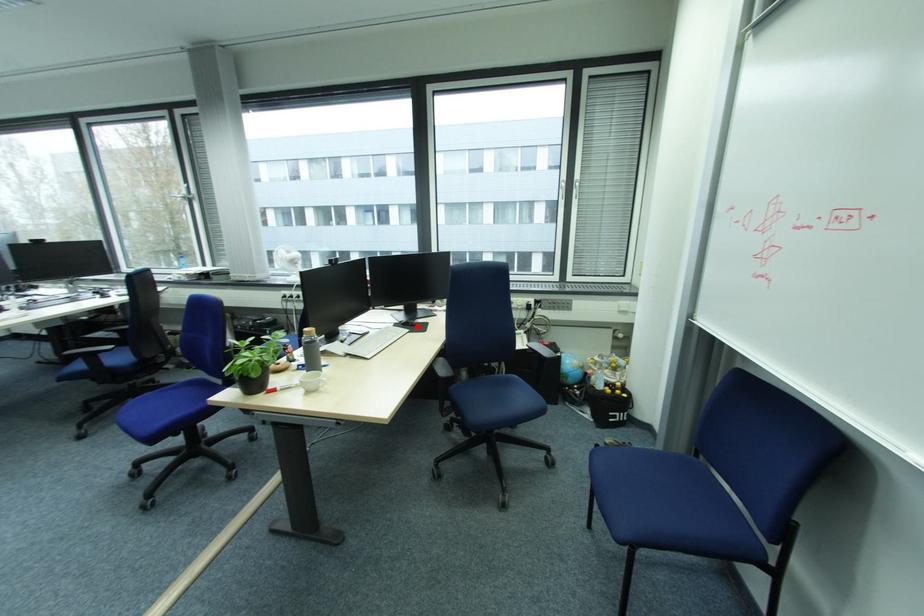
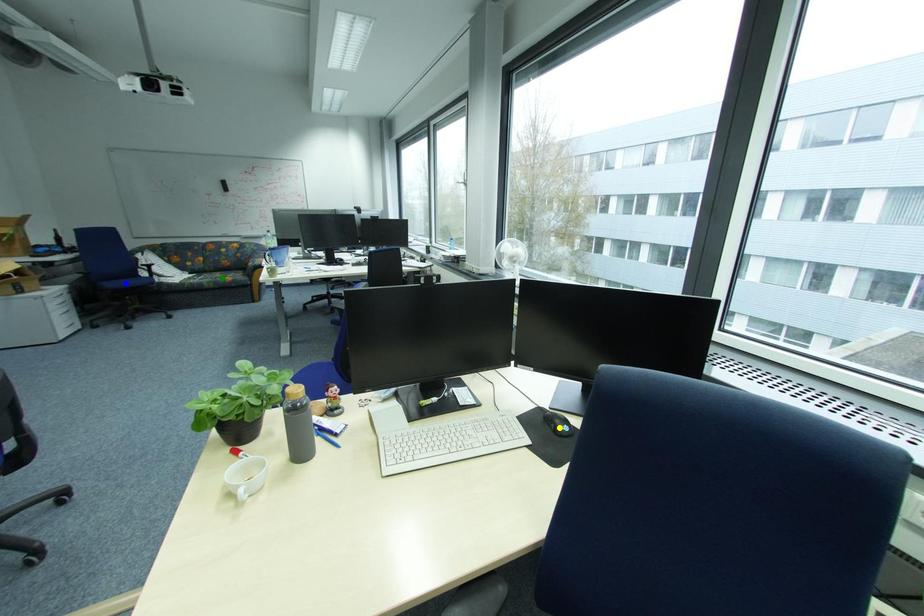
Question: I am providing you with two images of the same scene from different viewpoints. A red point is marked on the first image. You are given multiple points on the second image. Which point in image 2 is actually the same real-world point as the red point in image 1?

Choices:
 (A) blue point
 (B) yellow point
 (C) green point

Answer: (B)